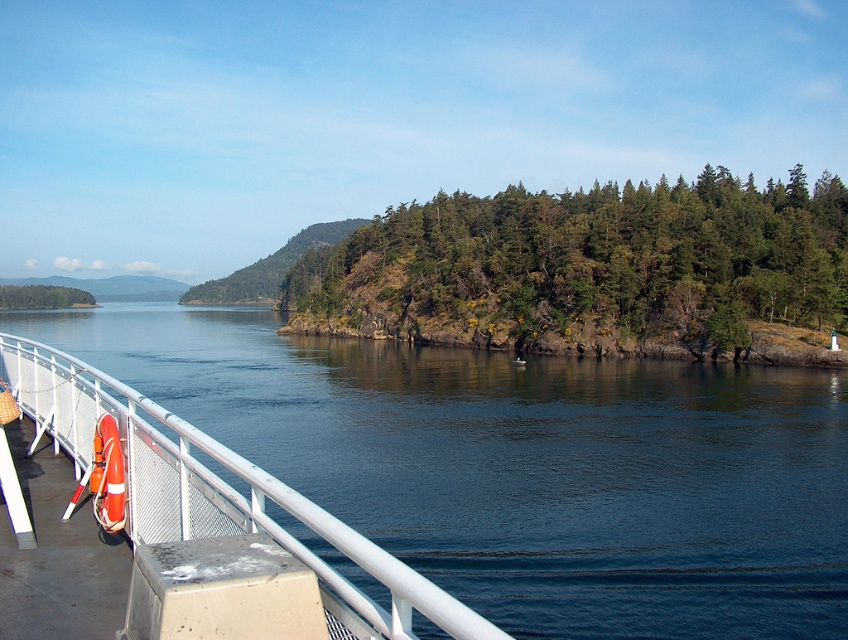
Question: Can you confirm if white metal/rail at left is positioned to the left of green matte tree at left?

Choices:
 (A) yes
 (B) no

Answer: (B)

Question: Does green rough textured trees at center appear under orange rubber life jacket at lower left?

Choices:
 (A) yes
 (B) no

Answer: (B)

Question: Can you confirm if orange rubber life jacket at lower left is positioned below green matte tree at left?

Choices:
 (A) yes
 (B) no

Answer: (A)

Question: Among these objects, which one is farthest from the camera?

Choices:
 (A) orange rubber life jacket at lower left
 (B) green matte tree at left
 (C) white metal/rail at left
 (D) green rough textured trees at center

Answer: (B)

Question: Which of these objects is positioned closest to the white metal/rail at left?

Choices:
 (A) green matte tree at left
 (B) green rough textured trees at center
 (C) orange rubber life jacket at lower left

Answer: (C)

Question: Based on their relative distances, which object is farther from the green matte tree at left?

Choices:
 (A) green rough textured trees at center
 (B) orange rubber life jacket at lower left
 (C) white metal/rail at left

Answer: (B)